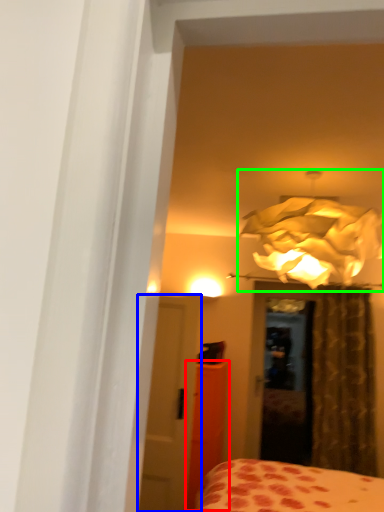
Question: Which is farther away from armoire (highlighted by a red box)? door (highlighted by a blue box) or lamp (highlighted by a green box)?

Choices:
 (A) door
 (B) lamp

Answer: (B)